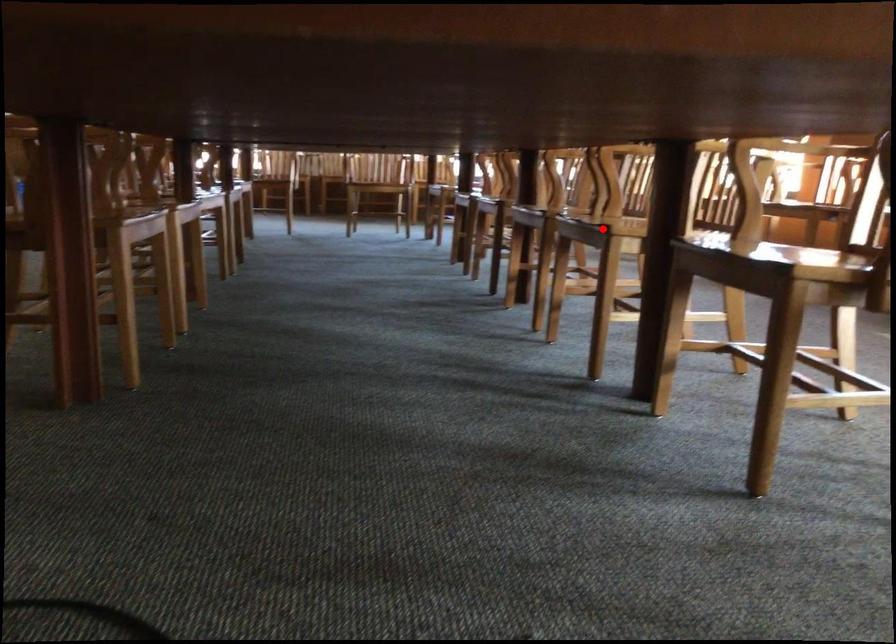
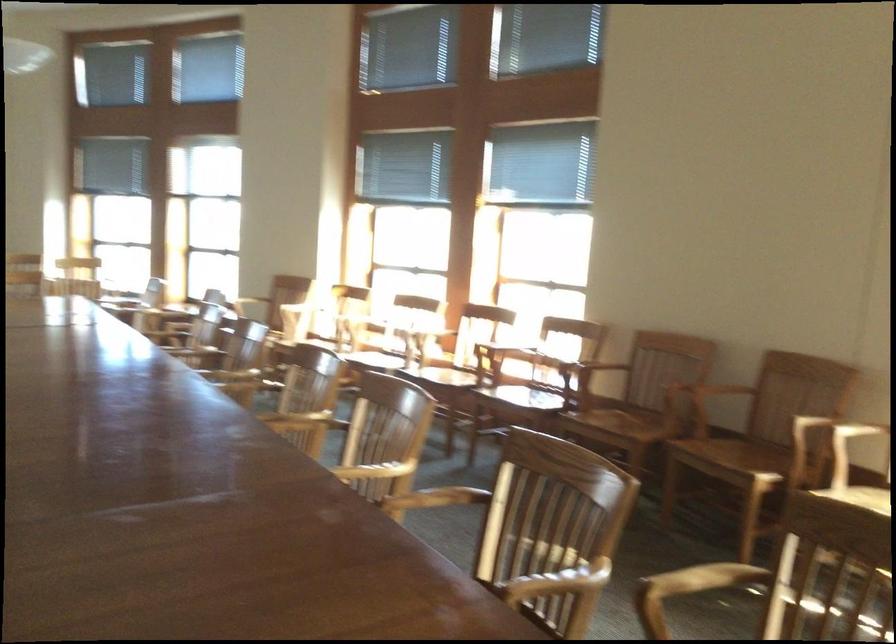
Question: I am providing you with two images of the same scene from different viewpoints. A red point is marked on the first image. At the location where the point appears in image 1, is it still visible in image 2?

Choices:
 (A) Yes
 (B) No

Answer: (B)